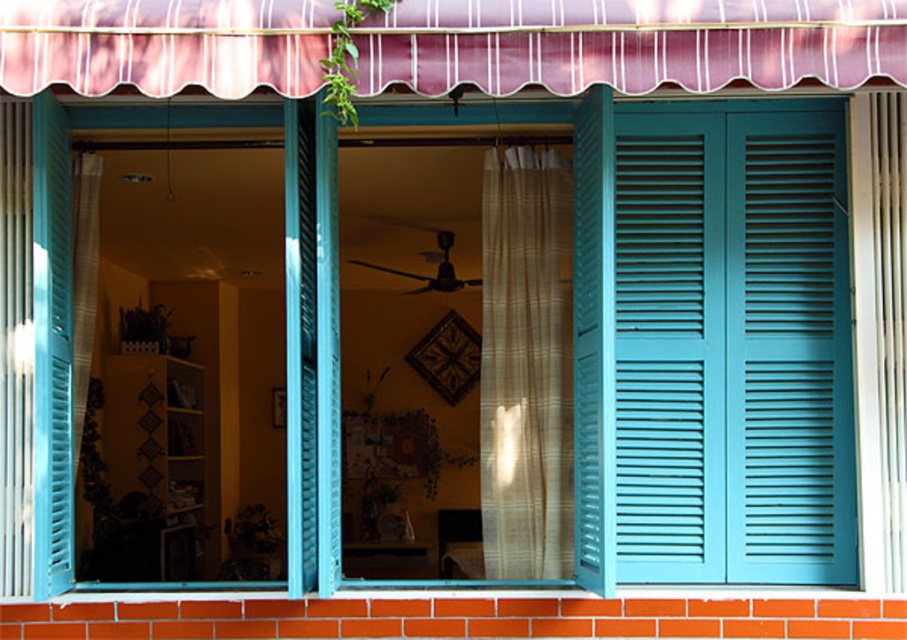
Which is more to the right, translucent beige curtain at center or translucent fabric curtain at left?

translucent beige curtain at center is more to the right.

Image resolution: width=907 pixels, height=640 pixels. What do you see at coordinates (525, 365) in the screenshot?
I see `translucent beige curtain at center` at bounding box center [525, 365].

Where is `translucent beige curtain at center`? The height and width of the screenshot is (640, 907). translucent beige curtain at center is located at coordinates (525, 365).

Is translucent beige curtain at center positioned behind white sheer curtain at right?

Yes, translucent beige curtain at center is behind white sheer curtain at right.

Is translucent beige curtain at center bigger than white sheer curtain at right?

Correct, translucent beige curtain at center is larger in size than white sheer curtain at right.

Which is in front, point (488, 205) or point (888, 326)?

Point (888, 326) is more forward.

What are the coordinates of `translucent beige curtain at center` in the screenshot? It's located at coord(525,365).

Who is more forward, (815, 525) or (83, 384)?

Positioned in front is point (815, 525).

Does teal matte shutters at right have a larger size compared to translucent fabric curtain at left?

Yes, teal matte shutters at right is bigger than translucent fabric curtain at left.

What are the coordinates of `teal matte shutters at right` in the screenshot? It's located at (733, 344).